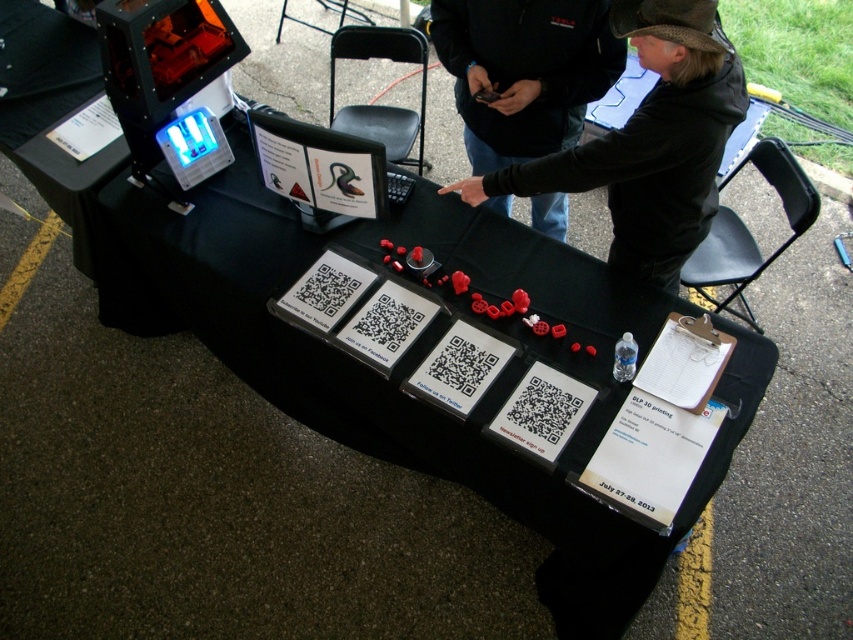
Question: Does black leather jacket at upper center appear on the left side of black leather jacket at center?

Choices:
 (A) yes
 (B) no

Answer: (B)

Question: Is black leather jacket at upper center above black leather jacket at center?

Choices:
 (A) no
 (B) yes

Answer: (A)

Question: Which of the following is the farthest from the observer?

Choices:
 (A) black leather jacket at center
 (B) black leather jacket at upper center

Answer: (A)

Question: Considering the relative positions of black leather jacket at upper center and black leather jacket at center in the image provided, where is black leather jacket at upper center located with respect to black leather jacket at center?

Choices:
 (A) above
 (B) below

Answer: (B)

Question: Which point appears farthest from the camera in this image?

Choices:
 (A) (663, 218)
 (B) (564, 211)

Answer: (B)